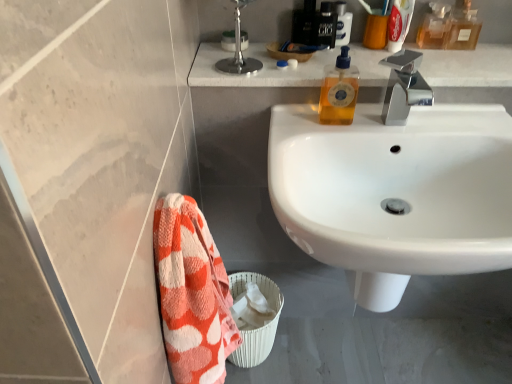
You are a GUI agent. You are given a task and a screenshot of the screen. Output one action in this format:
    pyautogui.click(x=<x>, y=<y>)
    Task: Click on the unoccupied region to the right of black plastic soap dispenser at upper right, which ranks as the first toiletry in top-to-bottom order
    This screenshot has width=512, height=384.
    Given the screenshot: What is the action you would take?
    pyautogui.click(x=412, y=54)